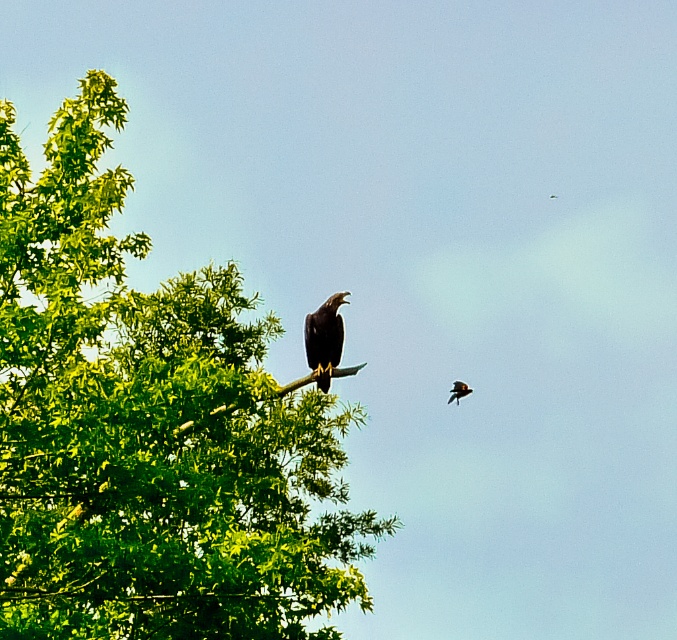
You are standing in the outdoor scene and want to take a photo of the green leafy tree at left. If your camera has a maximum focus range of 8 meters, will you be able to focus on the tree?

The green leafy tree at left is 8.65 meters away from the viewer. Since the camera can only focus up to 8 meters, it cannot focus on the tree.